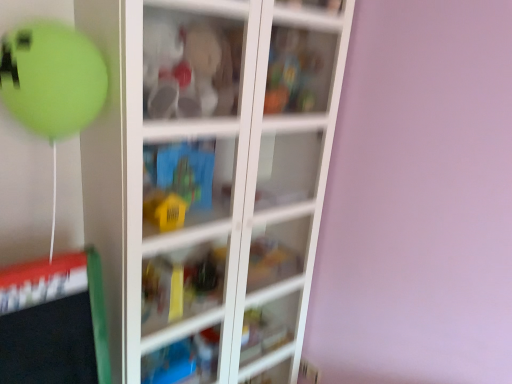
Question: Relative to transparent glass cabinet at center, is blue plastic toy at center, which is counted as the second cabinet, starting from the top, in front or behind?

Choices:
 (A) behind
 (B) front

Answer: (A)

Question: Visually, is blue plastic toy at center, which is counted as the second cabinet, starting from the top, positioned to the left or to the right of transparent glass cabinet at center?

Choices:
 (A) right
 (B) left

Answer: (B)

Question: Which object is the farthest from the transparent glass cabinet at center?

Choices:
 (A) blue plastic toy at center, the 2th cabinet viewed from the right
 (B) transparent plastic cabinet at upper center, arranged as the 1th cabinet when viewed from the top

Answer: (B)

Question: Which object is the closest to the blue plastic toy at center, which is counted as the second cabinet, starting from the top?

Choices:
 (A) transparent plastic cabinet at upper center, marked as the second cabinet in a left-to-right arrangement
 (B) transparent glass cabinet at center

Answer: (B)